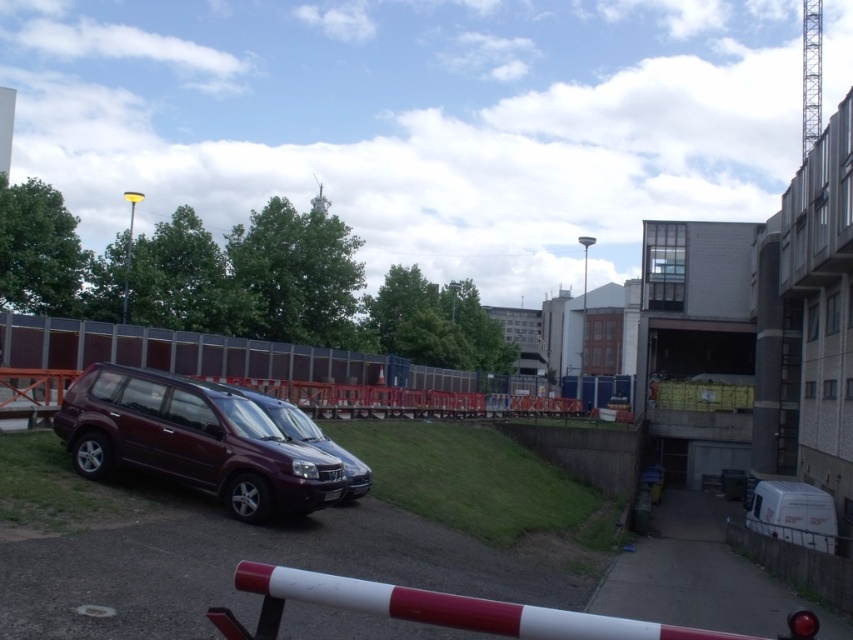
Question: Among these points, which one is nearest to the camera?

Choices:
 (A) (294, 426)
 (B) (259, 410)

Answer: (B)

Question: Does maroon matte suv at left appear on the right side of satin purple suv at center?

Choices:
 (A) yes
 (B) no

Answer: (B)

Question: Which point is closer to the camera taking this photo?

Choices:
 (A) (221, 460)
 (B) (355, 493)

Answer: (A)

Question: Can you confirm if maroon matte suv at left is positioned to the left of satin purple suv at center?

Choices:
 (A) yes
 (B) no

Answer: (A)

Question: Is maroon matte suv at left bigger than satin purple suv at center?

Choices:
 (A) yes
 (B) no

Answer: (A)